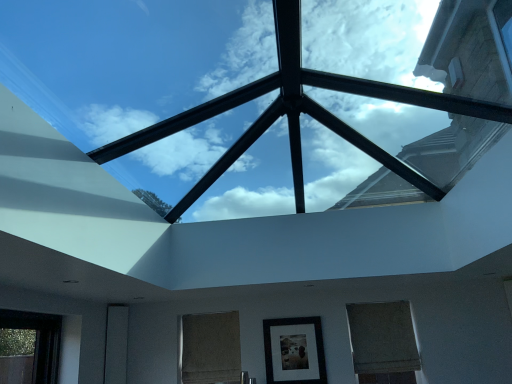
Question: Relative to transparent glass skylight at center, is matte black picture frame at center in front or behind?

Choices:
 (A) front
 (B) behind

Answer: (B)

Question: From a real-world perspective, is matte black picture frame at center above or below transparent glass skylight at center?

Choices:
 (A) above
 (B) below

Answer: (B)

Question: Which object is positioned farthest from the transparent glass skylight at center?

Choices:
 (A) matte black picture frame at center
 (B) matte brown blind at lower right, which ranks as the 1th window in right-to-left order
 (C) matte black glass door at lower left
 (D) burlap curtain at center, which is counted as the 1th window, starting from the left

Answer: (C)

Question: Which object is positioned farthest from the matte black glass door at lower left?

Choices:
 (A) matte brown blind at lower right, which ranks as the 1th window in right-to-left order
 (B) matte black picture frame at center
 (C) transparent glass skylight at center
 (D) burlap curtain at center, the 2th window in the right-to-left sequence

Answer: (A)